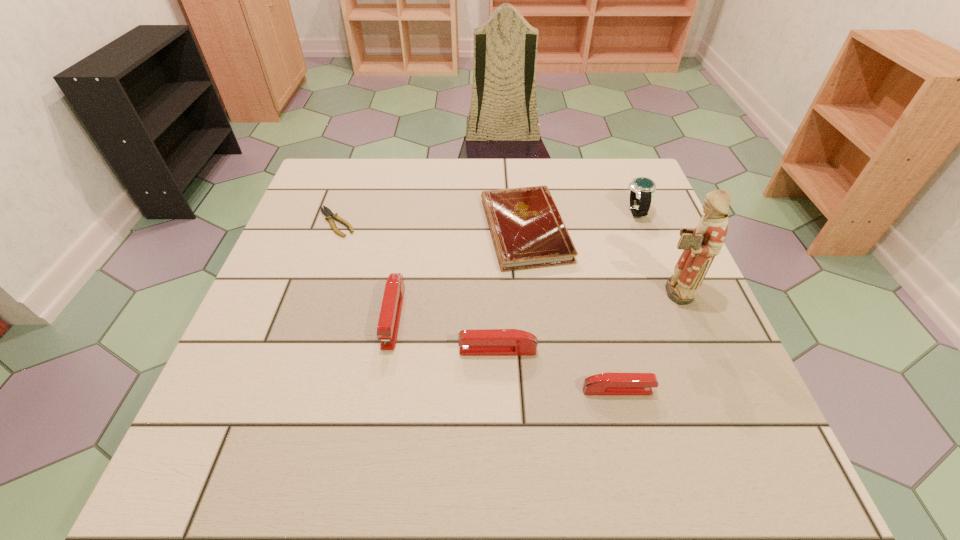
This screenshot has height=540, width=960. In order to click on vacant region located 0.380m on the front-facing side of the tallest object in this screenshot , I will do `click(480, 291)`.

In order to click on pliers that is at the far edge in this screenshot , I will do `click(331, 216)`.

Locate an element on the screen. Image resolution: width=960 pixels, height=540 pixels. notebook that is at the far edge is located at coordinates (527, 229).

Identify the location of watch located in the far edge section of the desktop. Image resolution: width=960 pixels, height=540 pixels. (642, 189).

Identify the location of object that is at the near edge. (607, 383).

Locate an element on the screen. object present at the left edge is located at coordinates (331, 216).

Identify the location of stapler at the right edge. (607, 383).

Where is `watch that is at the right edge`? This screenshot has height=540, width=960. watch that is at the right edge is located at coordinates (642, 189).

The width and height of the screenshot is (960, 540). What are the coordinates of `figurine present at the right edge` in the screenshot? It's located at (701, 244).

What are the coordinates of `object located at the far left corner` in the screenshot? It's located at (331, 216).